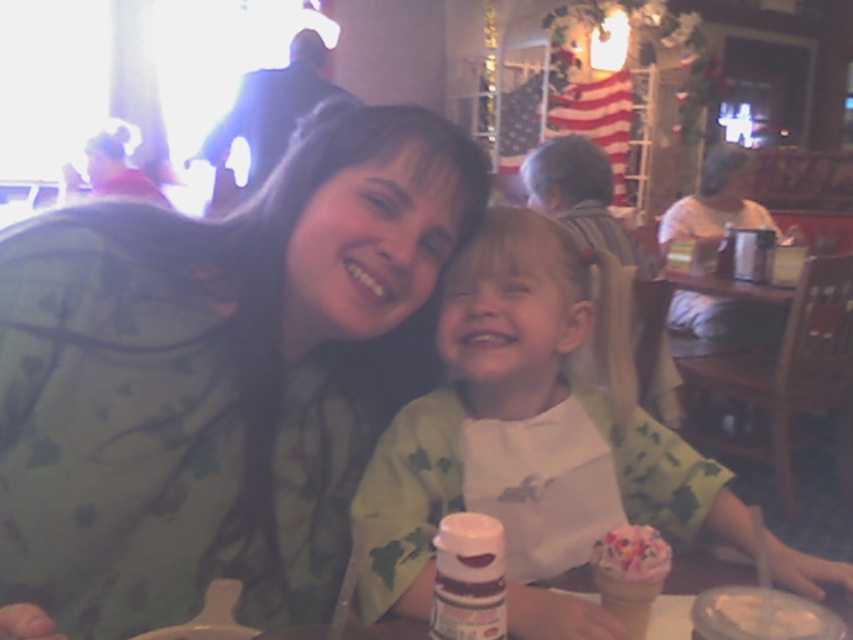
Who is positioned more to the left, matte green shirt at center or pink frosted ice cream at center?

From the viewer's perspective, matte green shirt at center appears more on the left side.

Consider the image. Who is more distant from viewer, (177, 609) or (618, 556)?

Positioned behind is point (177, 609).

Is point (51, 456) closer to viewer compared to point (624, 531)?

No, (51, 456) is further to viewer.

Where is `matte green shirt at center`? Image resolution: width=853 pixels, height=640 pixels. matte green shirt at center is located at coordinates (218, 376).

Which is in front, point (647, 538) or point (790, 636)?

Point (790, 636) is in front.

Does pink frosted ice cream at center have a smaller size compared to smooth white ice cream cone at lower center?

No.

Does point (637, 561) lie in front of point (769, 596)?

No, it is behind (769, 596).

I want to click on pink frosted ice cream at center, so pos(631,554).

Which of these two, matte green shirt at center or smooth white ice cream cone at lower center, stands taller?

With more height is matte green shirt at center.

Is matte green shirt at center above smooth white ice cream cone at lower center?

Yes.

You are a GUI agent. You are given a task and a screenshot of the screen. Output one action in this format:
    pyautogui.click(x=<x>, y=<y>)
    Task: Click on the matte green shirt at center
    The image size is (853, 640).
    Given the screenshot: What is the action you would take?
    pyautogui.click(x=218, y=376)

Where is `matte green shirt at center`? The width and height of the screenshot is (853, 640). matte green shirt at center is located at coordinates (218, 376).